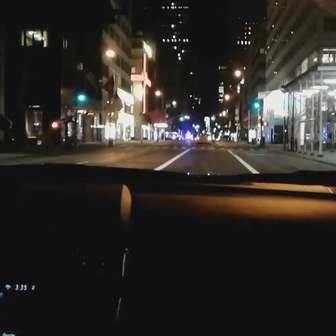
Identify the location of windows. The image size is (336, 336). (43, 36), (117, 33), (124, 67), (285, 50), (286, 16), (276, 103).